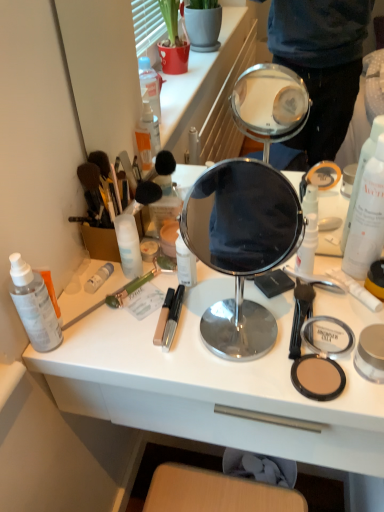
At what (x,y) coordinates should I click in order to perform the action: click on vacant space situated on the left part of matte yellow compact powder at right, the first toiletry when ordered from right to left. Please return your answer as a coordinate pair (x, y). The image size is (384, 512). Looking at the image, I should click on (289, 310).